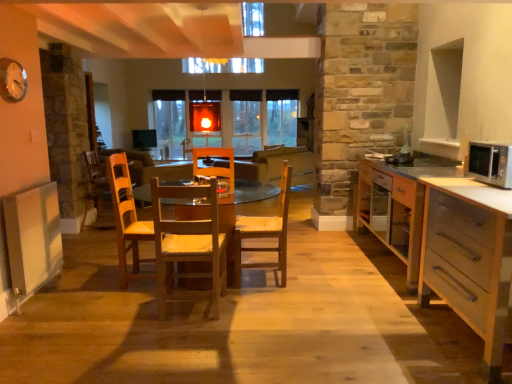
Question: Is the depth of wooden chair at center less than that of wooden chair at center, arranged as the 2th chair when viewed from the right?

Choices:
 (A) yes
 (B) no

Answer: (B)

Question: Are wooden chair at center and wooden chair at center, positioned as the 2th chair in back-to-front order, far apart?

Choices:
 (A) no
 (B) yes

Answer: (B)

Question: Is wooden chair at center taller than wooden chair at center, arranged as the 2th chair when viewed from the right?

Choices:
 (A) no
 (B) yes

Answer: (A)

Question: From the image's perspective, would you say wooden chair at center is positioned over wooden chair at center, which is the first chair from front to back?

Choices:
 (A) no
 (B) yes

Answer: (B)

Question: Is wooden chair at center outside of wooden chair at center, positioned as the 2th chair in back-to-front order?

Choices:
 (A) no
 (B) yes

Answer: (B)

Question: From the image's perspective, is silver metallic microwave at right positioned above or below light brown wood cabinet at right, which is the second cabinetry from front to back?

Choices:
 (A) above
 (B) below

Answer: (A)

Question: Is point (509, 168) closer or farther from the camera than point (378, 188)?

Choices:
 (A) farther
 (B) closer

Answer: (B)

Question: Considering the positions of silver metallic microwave at right and light brown wood cabinet at right, which appears as the first cabinetry when viewed from the back, in the image, is silver metallic microwave at right wider or thinner than light brown wood cabinet at right, which appears as the first cabinetry when viewed from the back,?

Choices:
 (A) thin
 (B) wide

Answer: (A)

Question: Is silver metallic microwave at right to the left or to the right of light brown wood cabinet at right, which appears as the first cabinetry when viewed from the back, in the image?

Choices:
 (A) right
 (B) left

Answer: (A)

Question: Considering the relative positions of light brown wood cabinet at right, which appears as the first cabinetry when viewed from the back, and wooden chair at center, positioned as the 2th chair in back-to-front order, in the image provided, is light brown wood cabinet at right, which appears as the first cabinetry when viewed from the back, to the left or to the right of wooden chair at center, positioned as the 2th chair in back-to-front order,?

Choices:
 (A) right
 (B) left

Answer: (A)

Question: Does point (372, 228) appear closer or farther from the camera than point (206, 235)?

Choices:
 (A) farther
 (B) closer

Answer: (A)

Question: From the image's perspective, is light brown wood cabinet at right, which appears as the first cabinetry when viewed from the back, positioned above or below wooden chair at center, positioned as the 2th chair in back-to-front order?

Choices:
 (A) above
 (B) below

Answer: (A)

Question: Considering the positions of light brown wood cabinet at right, which appears as the first cabinetry when viewed from the back, and wooden chair at center, positioned as the 2th chair in back-to-front order, in the image, is light brown wood cabinet at right, which appears as the first cabinetry when viewed from the back, bigger or smaller than wooden chair at center, positioned as the 2th chair in back-to-front order,?

Choices:
 (A) small
 (B) big

Answer: (B)

Question: From the image's perspective, is white glossy clock at upper left located above or below wooden chair at center, which appears as the 1th chair when viewed from the back?

Choices:
 (A) below
 (B) above

Answer: (B)

Question: From a real-world perspective, relative to wooden chair at center, positioned as the first chair in right-to-left order, is white glossy clock at upper left vertically above or below?

Choices:
 (A) above
 (B) below

Answer: (A)